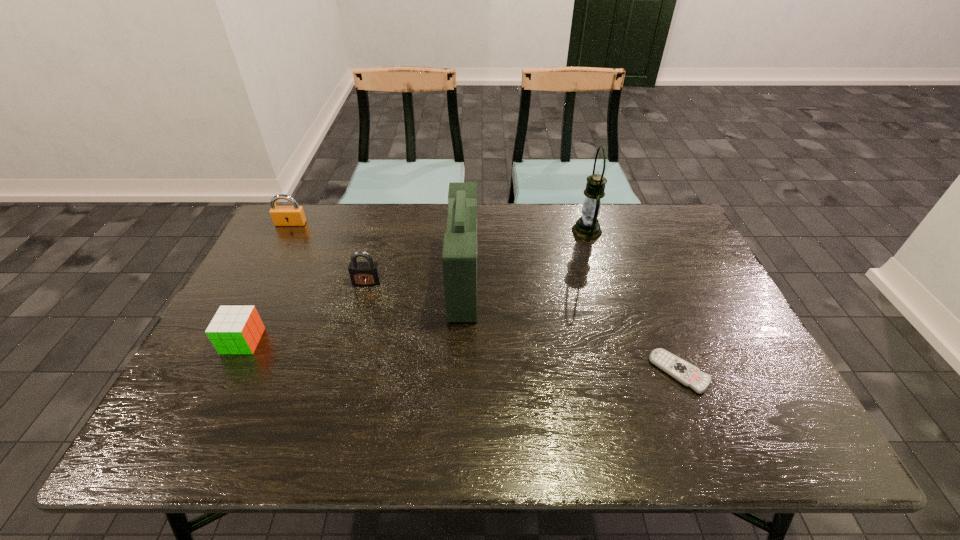
This screenshot has width=960, height=540. Find the location of `vacant space located 0.240m on the side where the lantern emits light`. vacant space located 0.240m on the side where the lantern emits light is located at coordinates (499, 231).

Where is `free space located on the side where the lantern emits light`? free space located on the side where the lantern emits light is located at coordinates (484, 231).

Locate an element on the screen. This screenshot has width=960, height=540. free space located on the front-facing side of the first-aid kit is located at coordinates (518, 280).

Identify the location of vacant space located to unlock the farther padlock from the front. The height and width of the screenshot is (540, 960). (282, 240).

At what (x,y) coordinates should I click in order to perform the action: click on free region located 0.230m on the front of the third object from left to right near the keyhole. Please return your answer as a coordinate pair (x, y). The image size is (960, 540). Looking at the image, I should click on (348, 352).

Find the location of a particular element. The width and height of the screenshot is (960, 540). vacant space located on the back of the cube is located at coordinates (278, 269).

I want to click on vacant space located on the back of the rightmost object, so click(642, 277).

You are a GUI agent. You are given a task and a screenshot of the screen. Output one action in this format:
    pyautogui.click(x=<x>, y=<y>)
    Task: Click on the lantern present at the far edge
    
    Given the screenshot: What is the action you would take?
    pyautogui.click(x=587, y=227)

The image size is (960, 540). Find the location of `the first-aid kit positioned at the far edge`. the first-aid kit positioned at the far edge is located at coordinates (459, 258).

You are a GUI agent. You are given a task and a screenshot of the screen. Output one action in this format:
    pyautogui.click(x=<x>, y=<y>)
    Task: Click on the padlock situated at the far edge
    This screenshot has height=540, width=960.
    Given the screenshot: What is the action you would take?
    pyautogui.click(x=294, y=215)